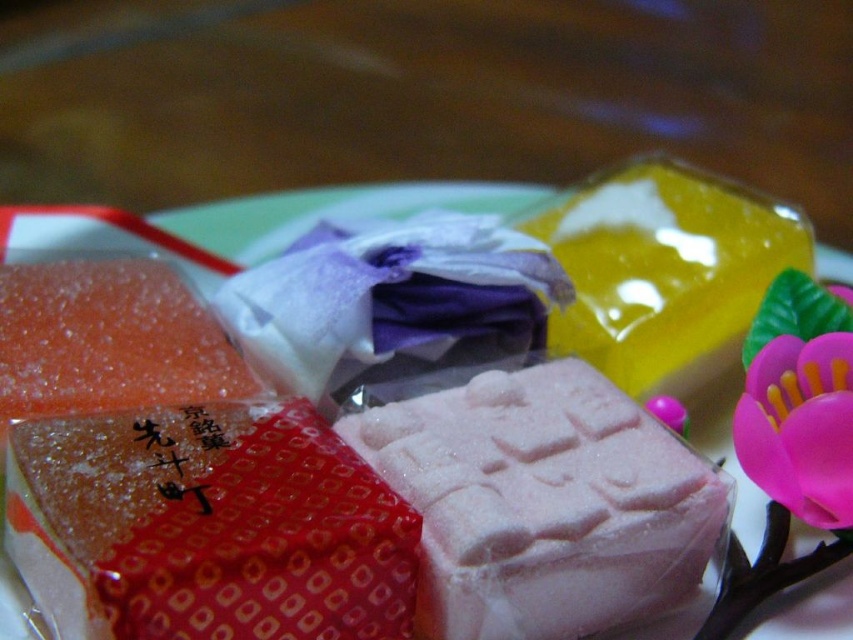
Can you confirm if pink sugary cube at center is smaller than white paper plate at center?

Incorrect, pink sugary cube at center is not smaller in size than white paper plate at center.

In the scene shown: Can you confirm if pink sugary cube at center is thinner than white paper plate at center?

Indeed, pink sugary cube at center has a lesser width compared to white paper plate at center.

This screenshot has height=640, width=853. Find the location of `pink sugary cube at center`. pink sugary cube at center is located at coordinates (543, 500).